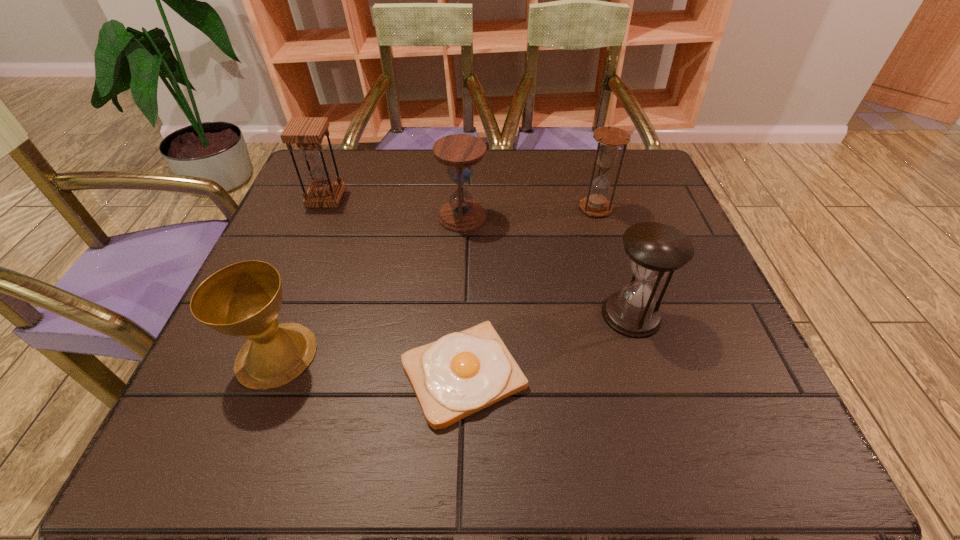
You are a GUI agent. You are given a task and a screenshot of the screen. Output one action in this format:
    pyautogui.click(x=<x>, y=<y>)
    Task: Click on the leftmost hourglass
    This screenshot has height=540, width=960.
    Given the screenshot: What is the action you would take?
    pyautogui.click(x=307, y=132)

Locate an element on the screen. The image size is (960, 540). the second hourglass from left to right is located at coordinates (459, 152).

Locate an element on the screen. Image resolution: width=960 pixels, height=540 pixels. the nearest hourglass is located at coordinates (655, 249).

Identify the location of chalice. (244, 299).

This screenshot has width=960, height=540. What are the coordinates of `the shortest object` in the screenshot? It's located at (461, 373).

This screenshot has height=540, width=960. What are the coordinates of `vacant area situated on the right of the leftmost hourglass` in the screenshot? It's located at (428, 198).

At what (x,y) coordinates should I click in order to perform the action: click on blank space located on the left of the second hourglass from left to right. Please return your answer as a coordinate pair (x, y). The height and width of the screenshot is (540, 960). Looking at the image, I should click on (397, 217).

This screenshot has width=960, height=540. Identify the location of free region located 0.170m on the front of the nearest hourglass. (665, 425).

Locate an element on the screen. vacant space located 0.250m on the right of the chalice is located at coordinates (453, 355).

Where is `vacant space situated on the right of the shortest object`? Image resolution: width=960 pixels, height=540 pixels. vacant space situated on the right of the shortest object is located at coordinates (715, 374).